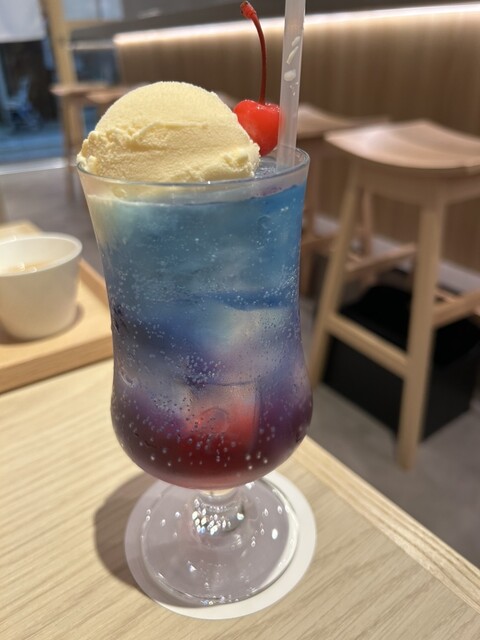
This screenshot has width=480, height=640. In order to click on bowl in this screenshot , I will do `click(32, 290)`.